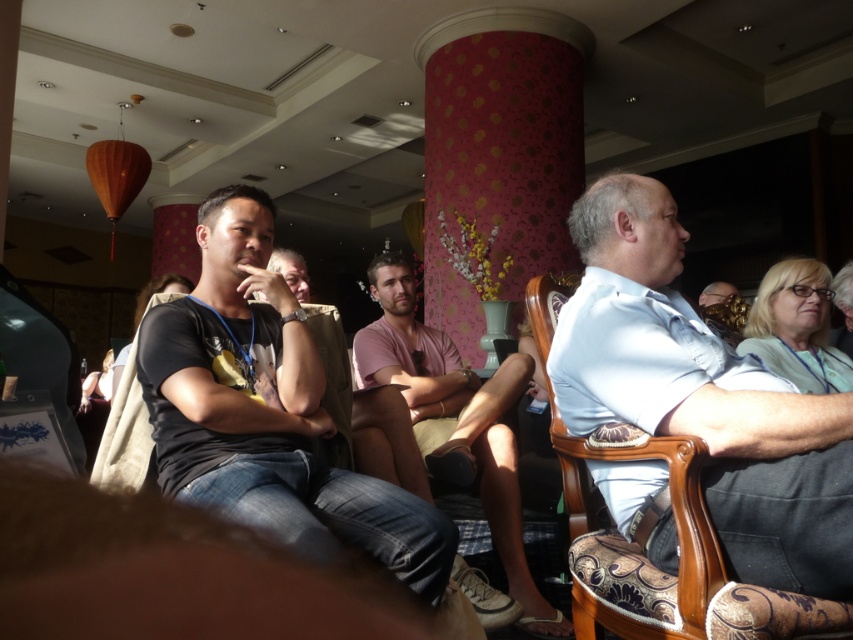
You are standing in the room and want to approach the denim jeans at lower left and the light blue shirt at center. Which one is closer to the floor?

The denim jeans at lower left is located below light blue shirt at center, so it is closer to the floor.

You are standing in the room and want to take a photo of both the man in the foreground and the person sitting to the right. Which of the two points, point (233, 337) or point (843, 273), will appear larger in your camera view?

Point (233, 337) will appear larger in the camera view because it is closer to the camera than point (843, 273).